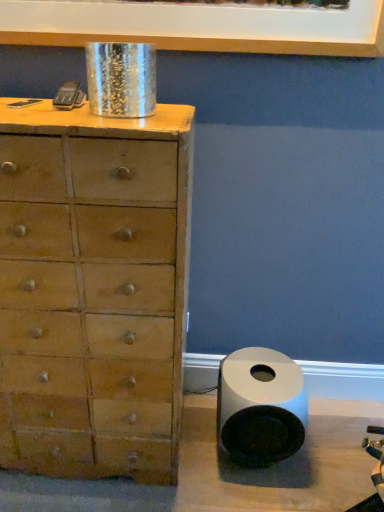
The image size is (384, 512). Identify the location of empty space that is to the right of white glossy speaker at lower right. (329, 454).